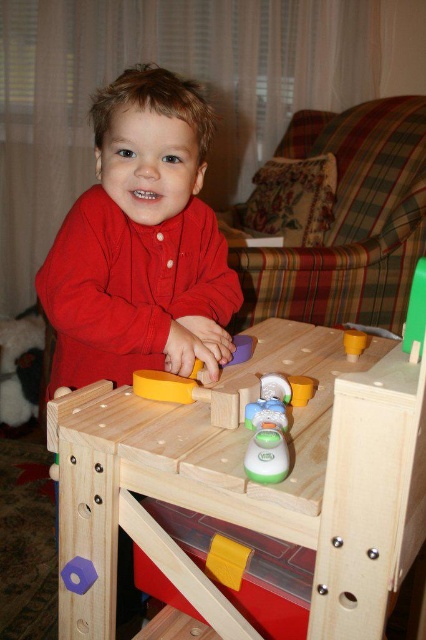
You are a toy designer observing the play area. There are two points marked on the table surface. The first point is at coordinate (x=114, y=532) and the second is at (x=126, y=307). Based on the spatial arrangement, which point is closer to you?

Point (x=114, y=532) is closer to the viewer than point (x=126, y=307).